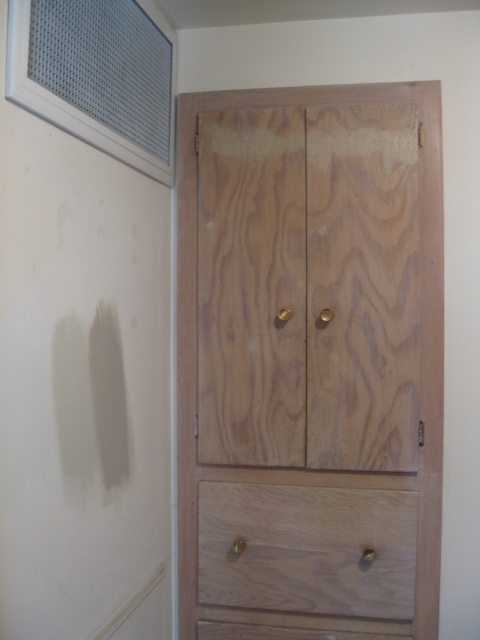
Question: Which object is closer to the camera taking this photo?

Choices:
 (A) natural wood drawer at lower center
 (B) natural wood dresser at center

Answer: (B)

Question: Which object appears farthest from the camera in this image?

Choices:
 (A) natural wood drawer at lower center
 (B) natural wood dresser at center

Answer: (A)

Question: Which object appears farthest from the camera in this image?

Choices:
 (A) natural wood dresser at center
 (B) natural wood drawer at lower center

Answer: (B)

Question: Is natural wood dresser at center bigger than natural wood drawer at lower center?

Choices:
 (A) yes
 (B) no

Answer: (A)

Question: Can you confirm if natural wood dresser at center is thinner than natural wood drawer at lower center?

Choices:
 (A) no
 (B) yes

Answer: (A)

Question: Observing the image, what is the correct spatial positioning of natural wood dresser at center in reference to natural wood drawer at lower center?

Choices:
 (A) left
 (B) right

Answer: (A)